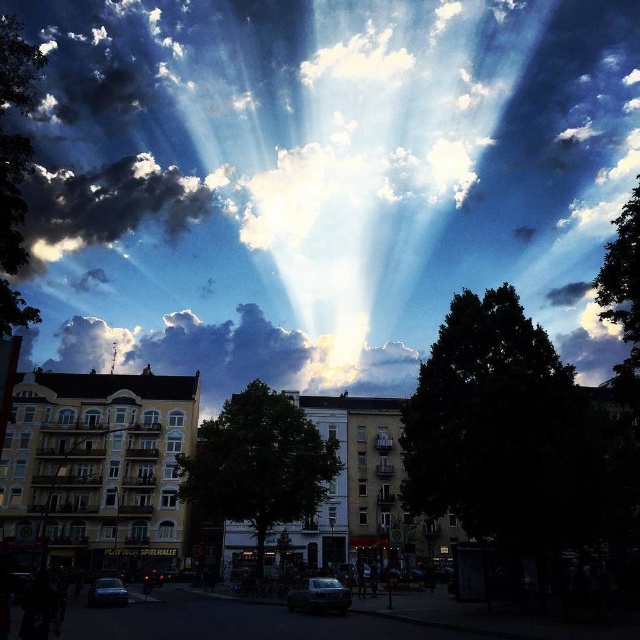
Based on the scene description, where is the point located at coordinates (236, 355)?

The point at coordinates (236, 355) corresponds to the cloudy sky at center.

You are an architect designing a new building and want to ensure it fits well within the existing urban landscape. You observe the cloudy sky at center and the green leafy tree at left. Which of these two elements occupies a greater horizontal space in the scene?

The cloudy sky at center occupies a greater horizontal space than the green leafy tree at left, as its width is larger according to the description.

You are standing in the middle of the urban area and looking up at the sky. Which object, the dark green leafy tree at center or the dark fluffy cloud at upper left, would block your view of the sun if you were to stand directly in front of it?

The dark green leafy tree at center is closer to the viewer than the dark fluffy cloud at upper left, so it would block your view of the sun first.